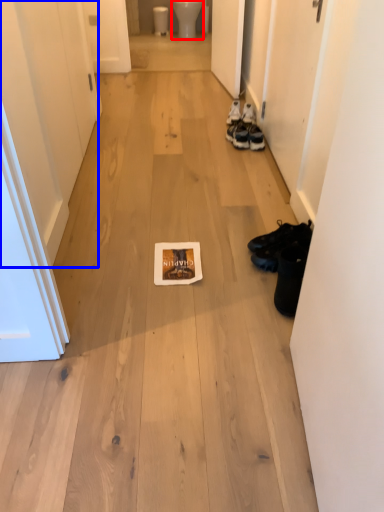
Question: Which of the following is the farthest to the observer, toilet bowl (highlighted by a red box) or door (highlighted by a blue box)?

Choices:
 (A) toilet bowl
 (B) door

Answer: (A)